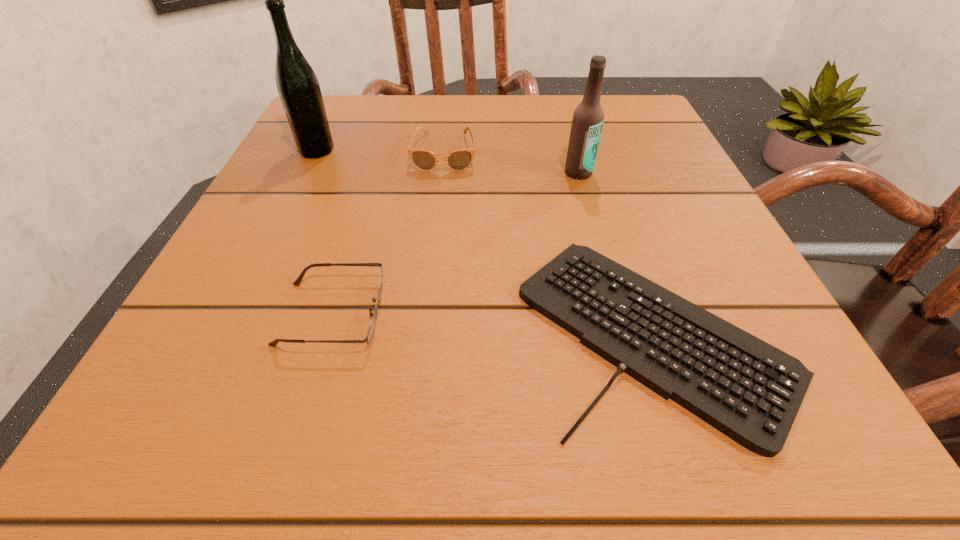
Where is `vacant area between the sunglasses and the second shortest object`? vacant area between the sunglasses and the second shortest object is located at coordinates (388, 233).

Identify the location of free area in between the farther beer bottle and the computer keyboard. The image size is (960, 540). (485, 241).

What are the coordinates of `unoccupied area between the third tallest object and the computer keyboard` in the screenshot? It's located at (549, 242).

At what (x,y) coordinates should I click in order to perform the action: click on vacant area that lies between the spectacles and the left beer bottle. Please return your answer as a coordinate pair (x, y). Looking at the image, I should click on (324, 232).

Locate an element on the screen. vacant space in between the taller beer bottle and the shortest object is located at coordinates click(x=485, y=241).

Where is `object identified as the closest to the sunglasses`? The width and height of the screenshot is (960, 540). object identified as the closest to the sunglasses is located at coordinates [298, 87].

Find the location of a particular element. This screenshot has width=960, height=540. object that is the fourth closest to the third tallest object is located at coordinates (297, 282).

The height and width of the screenshot is (540, 960). I want to click on free space that satisfies the following two spatial constraints: 1. on the side of the shortest object with the label; 2. on the right side of the nearer beer bottle, so click(x=623, y=330).

This screenshot has width=960, height=540. In order to click on vacant area in the image that satisfies the following two spatial constraints: 1. on the front-facing side of the sunglasses; 2. on the front-facing side of the spectacles in this screenshot , I will do `click(427, 314)`.

The height and width of the screenshot is (540, 960). Identify the location of vacant space that satisfies the following two spatial constraints: 1. on the front-facing side of the third tallest object; 2. on the right side of the shortest object. (425, 330).